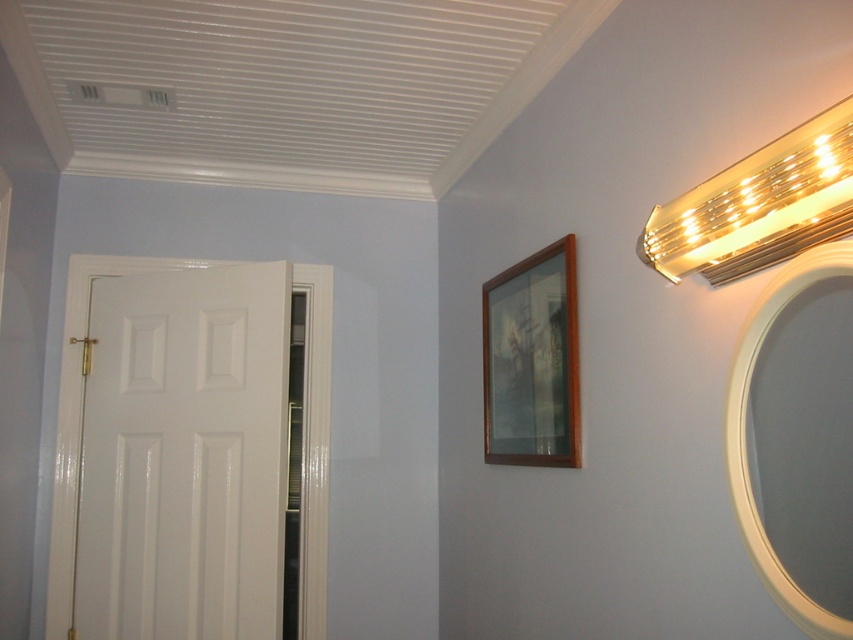
Who is positioned more to the left, gold metallic light fixture at upper right or wooden picture frame at upper right?

wooden picture frame at upper right

Can you confirm if gold metallic light fixture at upper right is positioned above wooden picture frame at upper right?

Correct, gold metallic light fixture at upper right is located above wooden picture frame at upper right.

This screenshot has width=853, height=640. What do you see at coordinates (759, 205) in the screenshot?
I see `gold metallic light fixture at upper right` at bounding box center [759, 205].

Where is `gold metallic light fixture at upper right`? The image size is (853, 640). gold metallic light fixture at upper right is located at coordinates 759,205.

This screenshot has width=853, height=640. Identify the location of gold metallic light fixture at upper right. (759, 205).

Does gold metallic light fixture at upper right lie in front of white glossy mirror at upper right?

Yes, gold metallic light fixture at upper right is closer to the viewer.

This screenshot has width=853, height=640. I want to click on gold metallic light fixture at upper right, so click(x=759, y=205).

Find the location of a particular element. Image resolution: width=853 pixels, height=640 pixels. gold metallic light fixture at upper right is located at coordinates (759, 205).

Which of these two, wooden picture frame at upper right or white glossy mirror at upper right, stands shorter?

white glossy mirror at upper right

Is wooden picture frame at upper right bigger than white glossy mirror at upper right?

Correct, wooden picture frame at upper right is larger in size than white glossy mirror at upper right.

At what (x,y) coordinates should I click in order to perform the action: click on wooden picture frame at upper right. Please return your answer as a coordinate pair (x, y). The image size is (853, 640). Looking at the image, I should click on (532, 360).

This screenshot has width=853, height=640. In order to click on wooden picture frame at upper right in this screenshot , I will do `click(532, 360)`.